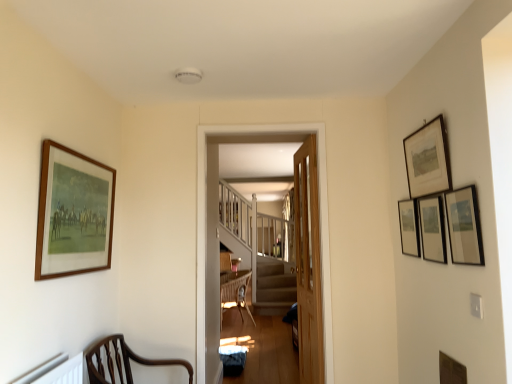
Question: In the image, is brown wood chair at lower left positioned in front of or behind wooden frame at left, positioned as the 1th picture frame in left-to-right order?

Choices:
 (A) behind
 (B) front

Answer: (A)

Question: Is brown wood chair at lower left spatially inside wooden frame at left, positioned as the sixth picture frame in right-to-left order, or outside of it?

Choices:
 (A) inside
 (B) outside

Answer: (B)

Question: Which is nearer to the brown wood chair at lower left?

Choices:
 (A) matte black picture frame at upper right, the second picture frame positioned from the right
 (B) matte black picture frame at upper right, acting as the 4th picture frame starting from the right
 (C) light brown wooden door at center
 (D) matte black picture frame at upper right, the fourth picture frame positioned from the left
 (E) light brown wooden door at center

Answer: (E)

Question: Which object is the farthest from the matte black picture frame at upper right, the fourth picture frame positioned from the left?

Choices:
 (A) wooden framed print at upper right, which ranks as the 5th picture frame in right-to-left order
 (B) wooden picture frame at lower right, arranged as the 6th picture frame when viewed from the left
 (C) brown wood chair at lower left
 (D) light brown wooden door at center
 (E) wooden frame at left, positioned as the sixth picture frame in right-to-left order

Answer: (E)